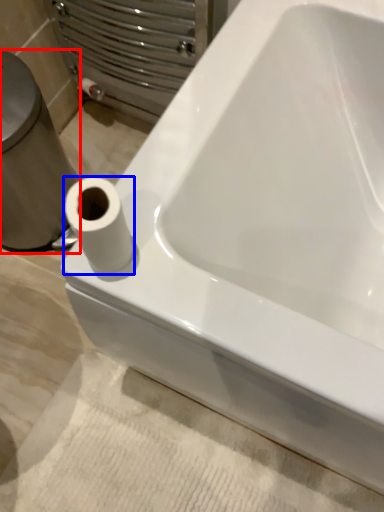
Question: Which object is closer to the camera taking this photo, porcelain (highlighted by a red box) or toilet paper (highlighted by a blue box)?

Choices:
 (A) porcelain
 (B) toilet paper

Answer: (B)